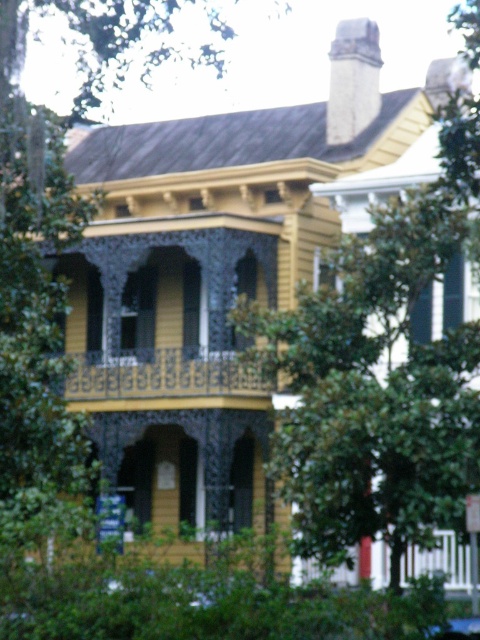
Can you confirm if green leafy tree at center is smaller than white stone chimney at upper center?

No, green leafy tree at center is not smaller than white stone chimney at upper center.

Who is more distant from viewer, (389, 536) or (362, 102)?

Positioned behind is point (362, 102).

Find the location of a particular element. green leafy tree at center is located at coordinates (372, 388).

Identify the location of green leafy tree at center. (372, 388).

Locate an element on the screen. This screenshot has height=640, width=480. green leafy tree at left is located at coordinates (37, 344).

Locate an element on the screen. The height and width of the screenshot is (640, 480). green leafy tree at left is located at coordinates (37, 344).

Does green leafy tree at left have a smaller size compared to wooden carved railings at center?

No.

Is green leafy tree at left positioned before wooden carved railings at center?

That is True.

Does point (22, 524) come in front of point (249, 371)?

Yes, it is in front of point (249, 371).

The height and width of the screenshot is (640, 480). What are the coordinates of `green leafy tree at left` in the screenshot? It's located at (37, 344).